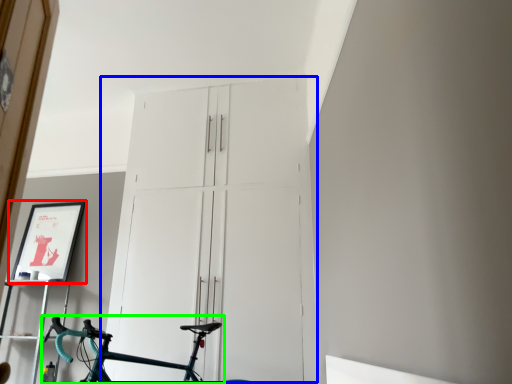
Question: Which object is the closest to the picture frame (highlighted by a red box)? Choose among these: door (highlighted by a blue box) or bicycle (highlighted by a green box).

Choices:
 (A) door
 (B) bicycle

Answer: (B)